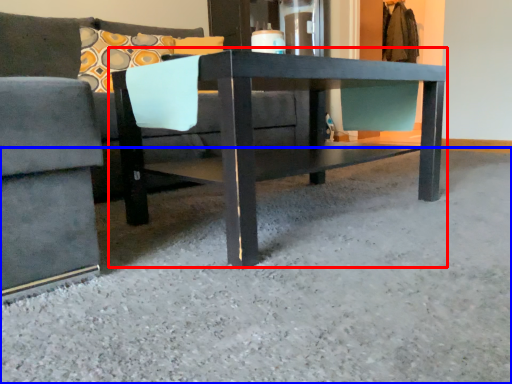
Question: Which object appears closest to the camera in this image, table (highlighted by a red box) or concrete (highlighted by a blue box)?

Choices:
 (A) table
 (B) concrete

Answer: (B)